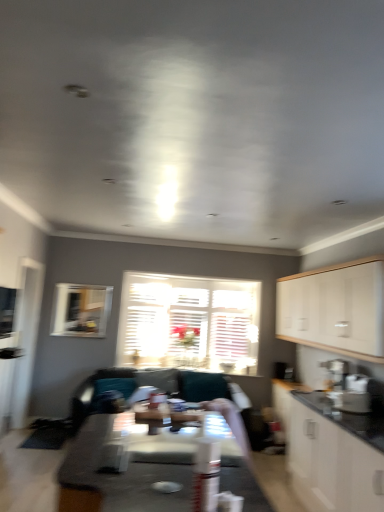
Question: Is smooth white table at center, which is counted as the second table, starting from the top, positioned before white matte cabinet at right, which is the first cabinetry from top to bottom?

Choices:
 (A) yes
 (B) no

Answer: (A)

Question: From a real-world perspective, is smooth white table at center, which is the 1th table from bottom to top, located beneath white matte cabinet at right, which appears as the second cabinetry when ordered from the bottom?

Choices:
 (A) no
 (B) yes

Answer: (B)

Question: From the image's perspective, is smooth white table at center, which is the 1th table from bottom to top, on white matte cabinet at right, which is the first cabinetry from top to bottom?

Choices:
 (A) yes
 (B) no

Answer: (B)

Question: Is smooth white table at center, which is counted as the second table, starting from the top, looking in the opposite direction of white matte cabinet at right, which appears as the second cabinetry when ordered from the bottom?

Choices:
 (A) yes
 (B) no

Answer: (B)

Question: Does smooth white table at center, which is counted as the second table, starting from the top, have a lesser height compared to white matte cabinet at right, which appears as the second cabinetry when ordered from the bottom?

Choices:
 (A) no
 (B) yes

Answer: (B)

Question: From the image's perspective, is smooth white table at center, which is the 1th table from bottom to top, under white matte cabinet at right, which is the first cabinetry from top to bottom?

Choices:
 (A) yes
 (B) no

Answer: (A)

Question: Is smooth white table at center, which is the 1th table from bottom to top, outside of clear glass window at upper left, acting as the first window starting from the front?

Choices:
 (A) no
 (B) yes

Answer: (B)

Question: From the image's perspective, would you say smooth white table at center, which is the 1th table from bottom to top, is positioned over clear glass window at upper left, acting as the first window starting from the front?

Choices:
 (A) yes
 (B) no

Answer: (B)

Question: Is smooth white table at center, which is counted as the second table, starting from the top, taller than clear glass window at upper left, acting as the 1th window starting from the left?

Choices:
 (A) yes
 (B) no

Answer: (B)

Question: Is the depth of smooth white table at center, which is the 1th table from bottom to top, less than that of clear glass window at upper left, the second window when ordered from back to front?

Choices:
 (A) no
 (B) yes

Answer: (B)

Question: From the image's perspective, does smooth white table at center, which is the 1th table from bottom to top, appear lower than clear glass window at upper left, the second window when ordered from back to front?

Choices:
 (A) yes
 (B) no

Answer: (A)

Question: Does smooth white table at center, which is counted as the second table, starting from the top, have a lesser height compared to clear glass window at upper left, acting as the first window starting from the front?

Choices:
 (A) no
 (B) yes

Answer: (B)

Question: Considering the relative sizes of white matte cabinet at right, which appears as the second cabinetry when ordered from the bottom, and wooden glossy table at center, placed as the first table when sorted from top to bottom, in the image provided, is white matte cabinet at right, which appears as the second cabinetry when ordered from the bottom, thinner than wooden glossy table at center, placed as the first table when sorted from top to bottom,?

Choices:
 (A) yes
 (B) no

Answer: (A)